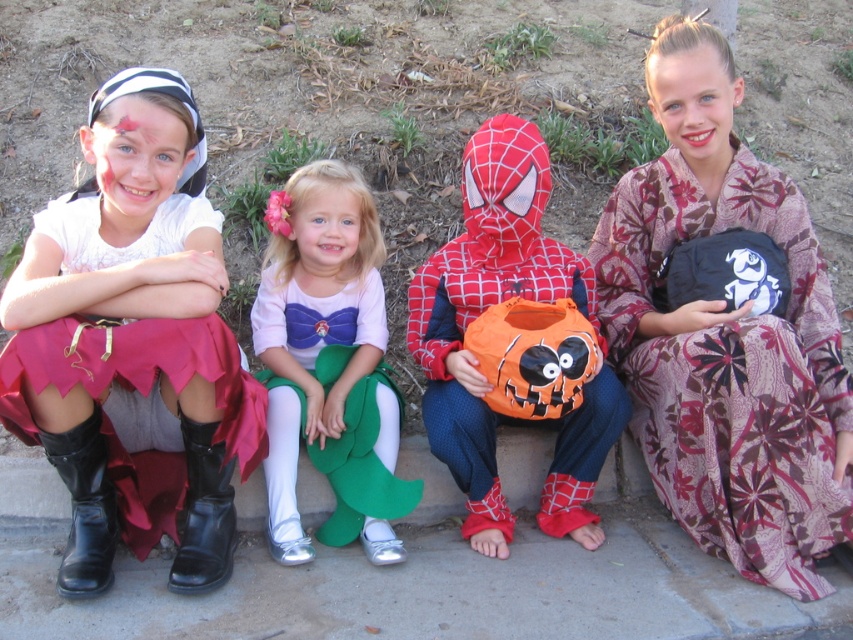
Does point (128, 499) come farther from viewer compared to point (453, 419)?

That is True.

Can you confirm if matte black boots at lower left is wider than rubberized plastic pumpkin at center?

No.

Locate an element on the screen. The height and width of the screenshot is (640, 853). matte black boots at lower left is located at coordinates (132, 344).

Can you confirm if matte black boots at lower left is smaller than black fabric bag at right?

Indeed, matte black boots at lower left has a smaller size compared to black fabric bag at right.

Is point (221, 348) positioned behind point (851, 474)?

That is False.

At what (x,y) coordinates should I click in order to perform the action: click on matte black boots at lower left. Please return your answer as a coordinate pair (x, y). Looking at the image, I should click on (132, 344).

Does pink satin dress at center have a lesser height compared to rubberized plastic pumpkin at center?

Yes.

Does pink satin dress at center have a larger size compared to rubberized plastic pumpkin at center?

Actually, pink satin dress at center might be smaller than rubberized plastic pumpkin at center.

Is point (379, 285) positioned after point (457, 362)?

Yes, it is.

Find the location of `pink satin dress at center`. pink satin dress at center is located at coordinates (328, 364).